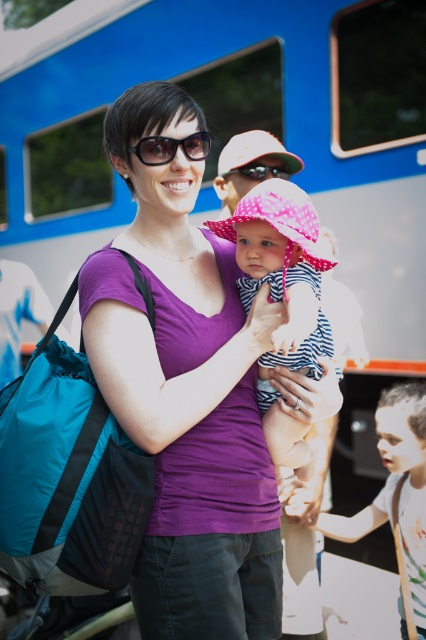
Question: Which point is closer to the camera taking this photo?

Choices:
 (A) (169, 499)
 (B) (408, 444)
 (C) (256, 160)

Answer: (A)

Question: Which point is closer to the camera?

Choices:
 (A) [x=422, y=342]
 (B) [x=204, y=140]
 (C) [x=221, y=173]

Answer: (B)

Question: Which point is farther to the camera?

Choices:
 (A) purple matte shirt at center
 (B) matte black goggles at center
 (C) blue metallic train at upper center

Answer: (C)

Question: Is purple matte shirt at center to the right of striped fabric baby at center from the viewer's perspective?

Choices:
 (A) no
 (B) yes

Answer: (A)

Question: Can you confirm if striped fabric baby at center is bigger than matte black goggles at center?

Choices:
 (A) yes
 (B) no

Answer: (A)

Question: Does light brown hair at lower right appear on the left side of matte black goggles at center?

Choices:
 (A) no
 (B) yes

Answer: (A)